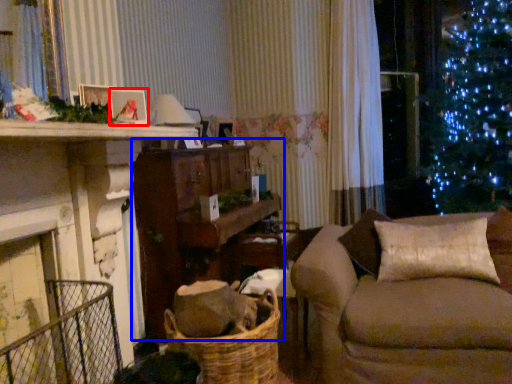
Question: Which object appears farthest to the camera in this image, picture frame (highlighted by a red box) or table (highlighted by a blue box)?

Choices:
 (A) picture frame
 (B) table

Answer: (B)